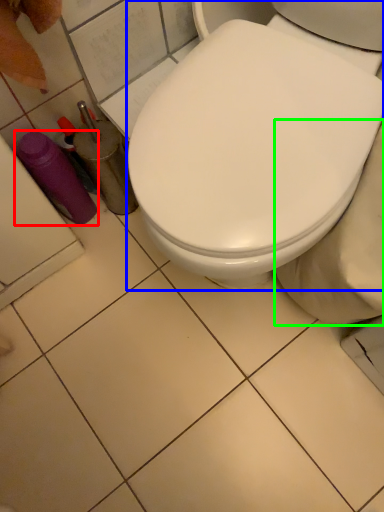
Question: Which is nearer to the bottle (highlighted by a red box)? toilet (highlighted by a blue box) or bidet (highlighted by a green box).

Choices:
 (A) toilet
 (B) bidet

Answer: (A)